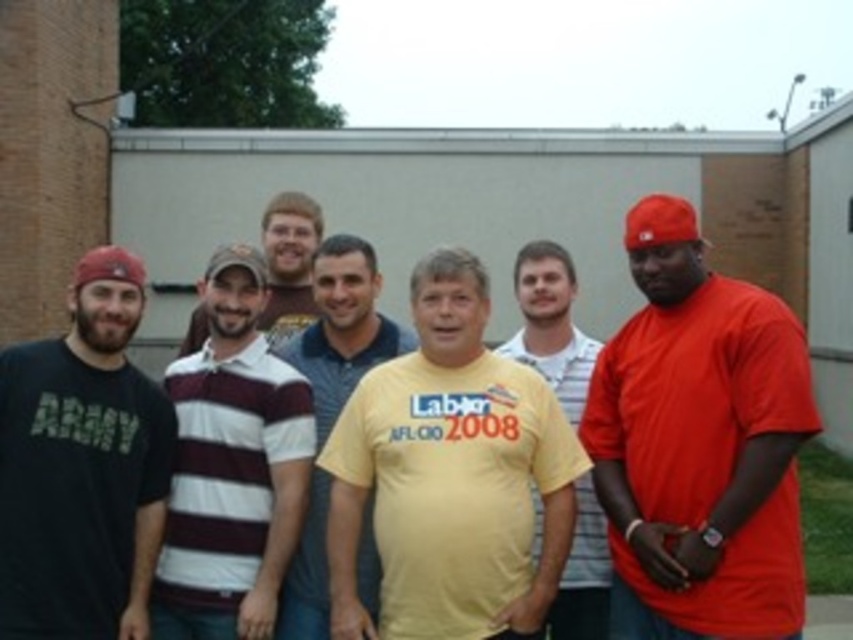
Question: Can you confirm if yellow matte t-shirt at center is positioned to the right of yellow cotton shirt at center?

Choices:
 (A) no
 (B) yes

Answer: (B)

Question: Which point is farther from the camera taking this photo?

Choices:
 (A) (328, 483)
 (B) (277, 228)

Answer: (B)

Question: Which object is closer to the camera taking this photo?

Choices:
 (A) black matte t-shirt at left
 (B) matte red t-shirt at right
 (C) yellow matte t-shirt at center
 (D) yellow cotton shirt at center

Answer: (B)

Question: Which point is farther to the camera?

Choices:
 (A) (607, 557)
 (B) (440, 332)
 (C) (370, 552)
 (D) (254, 472)

Answer: (A)

Question: Does yellow matte t-shirt at center have a smaller size compared to yellow matte shirt at center?

Choices:
 (A) yes
 (B) no

Answer: (B)

Question: Is maroon and white striped polo shirt at center positioned behind yellow cotton shirt at center?

Choices:
 (A) no
 (B) yes

Answer: (A)